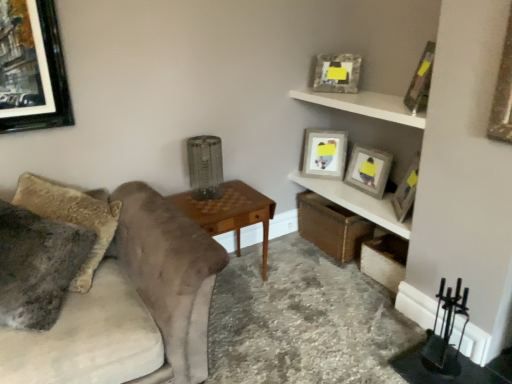
Question: Is the depth of wooden textured picture frame at upper right, marked as the 2th picture frame in a back-to-front arrangement, less than that of fuzzy fabric pillow at left?

Choices:
 (A) no
 (B) yes

Answer: (A)

Question: Is wooden textured picture frame at upper right, marked as the 2th picture frame in a back-to-front arrangement, thinner than fuzzy fabric pillow at left?

Choices:
 (A) yes
 (B) no

Answer: (A)

Question: Is wooden textured picture frame at upper right, marked as the 2th picture frame in a back-to-front arrangement, aimed at fuzzy fabric pillow at left?

Choices:
 (A) no
 (B) yes

Answer: (A)

Question: Would you consider wooden textured picture frame at upper right, which appears as the fourth picture frame when viewed from the front, to be distant from fuzzy fabric pillow at left?

Choices:
 (A) no
 (B) yes

Answer: (B)

Question: From the image's perspective, is wooden textured picture frame at upper right, marked as the 2th picture frame in a back-to-front arrangement, on top of fuzzy fabric pillow at left?

Choices:
 (A) yes
 (B) no

Answer: (A)

Question: Are wooden textured picture frame at upper right, marked as the 2th picture frame in a back-to-front arrangement, and fuzzy fabric pillow at left making contact?

Choices:
 (A) no
 (B) yes

Answer: (A)

Question: From a real-world perspective, is wooden textured picture frame at upper right, marked as the 2th picture frame in a back-to-front arrangement, physically below woodenobject at center?

Choices:
 (A) yes
 (B) no

Answer: (B)

Question: From the image's perspective, is wooden textured picture frame at upper right, marked as the 2th picture frame in a back-to-front arrangement, above woodenobject at center?

Choices:
 (A) yes
 (B) no

Answer: (A)

Question: Does wooden textured picture frame at upper right, which appears as the fourth picture frame when viewed from the front, come behind woodenobject at center?

Choices:
 (A) yes
 (B) no

Answer: (A)

Question: Is wooden textured picture frame at upper right, which appears as the fourth picture frame when viewed from the front, thinner than woodenobject at center?

Choices:
 (A) yes
 (B) no

Answer: (A)

Question: Is wooden textured picture frame at upper right, which appears as the fourth picture frame when viewed from the front, next to woodenobject at center and touching it?

Choices:
 (A) no
 (B) yes

Answer: (A)

Question: Does wooden textured picture frame at upper right, marked as the 2th picture frame in a back-to-front arrangement, have a greater width compared to woodenobject at center?

Choices:
 (A) yes
 (B) no

Answer: (B)

Question: Is wooden shelf at upper right, positioned as the 1th shelf in bottom-to-top order, behind wooden picture frame at upper right, the fourth picture frame positioned from the back?

Choices:
 (A) yes
 (B) no

Answer: (A)